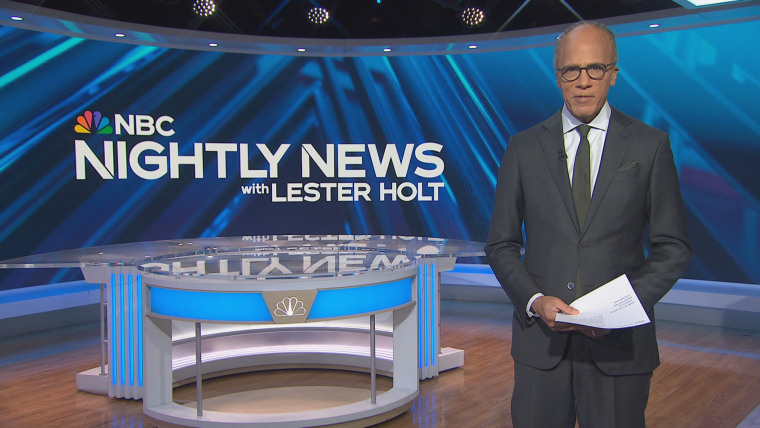
This screenshot has height=428, width=760. Find the location of `desk`. desk is located at coordinates (232, 247).